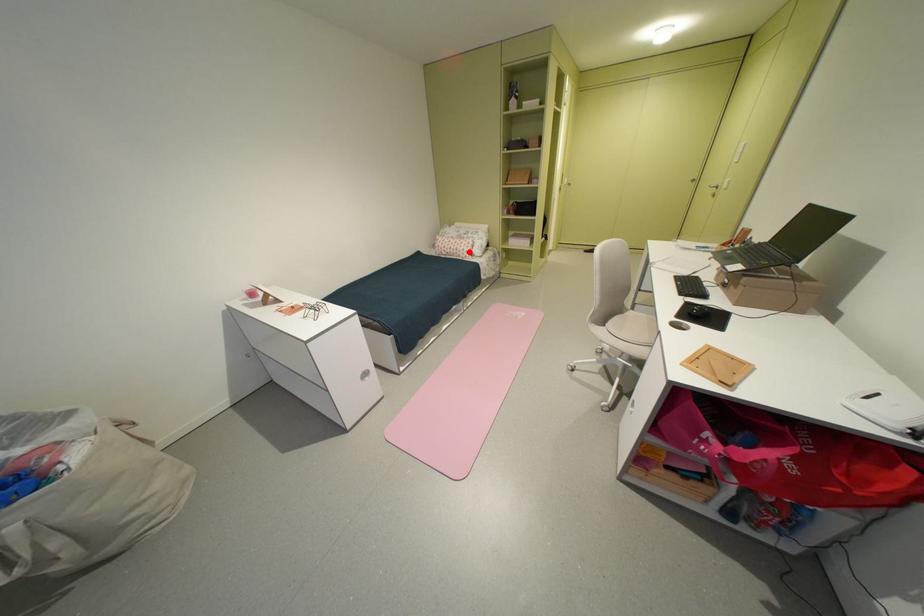
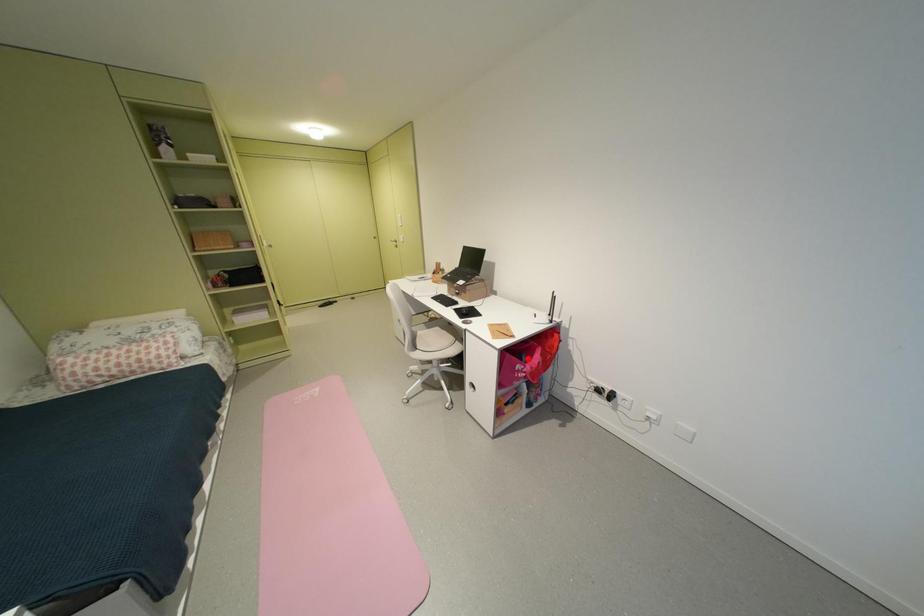
I am providing you with two images of the same scene from different viewpoints. A red point is marked on the first image and another point is marked on the second image. Is the marked point in image1 the same physical position as the marked point in image2?

No